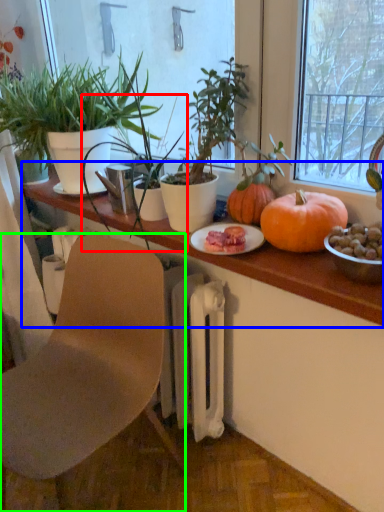
Question: Which object is the farthest from houseplant (highlighted by a red box)? Choose among these: table (highlighted by a blue box) or chair (highlighted by a green box).

Choices:
 (A) table
 (B) chair

Answer: (B)